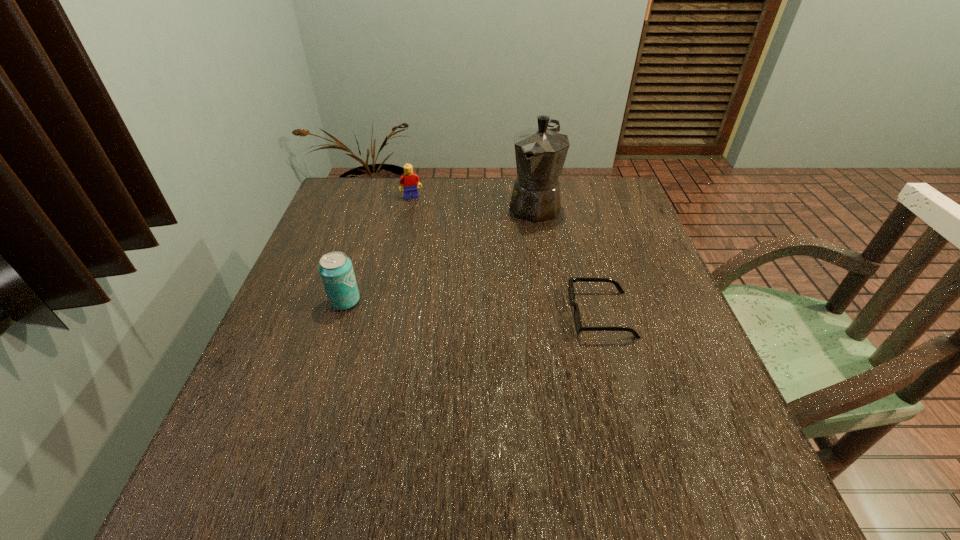
You are a GUI agent. You are given a task and a screenshot of the screen. Output one action in this format:
    pyautogui.click(x=<x>, y=<y>)
    Task: Click on the free space between the sunglasses and the beer can
    This screenshot has height=540, width=960.
    Given the screenshot: What is the action you would take?
    pyautogui.click(x=473, y=307)

Find the location of `vacant space in between the shortest object and the coffeepot`. vacant space in between the shortest object and the coffeepot is located at coordinates (567, 260).

The height and width of the screenshot is (540, 960). Find the location of `free space between the tallest object and the second object from left to right`. free space between the tallest object and the second object from left to right is located at coordinates (473, 201).

This screenshot has height=540, width=960. I want to click on free space between the shortest object and the third object from right to left, so click(506, 255).

Select which object appears as the closest to the third object from right to left. Please provide its 2D coordinates. Your answer should be formatted as a tuple, i.e. [(x, y)], where the tuple contains the x and y coordinates of a point satisfying the conditions above.

[(540, 152)]

Locate an element on the screen. The height and width of the screenshot is (540, 960). object that is the second closest one to the shortest object is located at coordinates (336, 271).

Find the location of `free spot that satisfies the following two spatial constraints: 1. on the front side of the Lego; 2. on the front-facing side of the sunglasses`. free spot that satisfies the following two spatial constraints: 1. on the front side of the Lego; 2. on the front-facing side of the sunglasses is located at coordinates click(x=386, y=314).

Find the location of a particular element. The height and width of the screenshot is (540, 960). free location that satisfies the following two spatial constraints: 1. on the front side of the third object from right to left; 2. on the front-facing side of the sunglasses is located at coordinates (386, 314).

Locate an element on the screen. free space that satisfies the following two spatial constraints: 1. on the front side of the sunglasses; 2. on the front-facing side of the coffeepot is located at coordinates (552, 314).